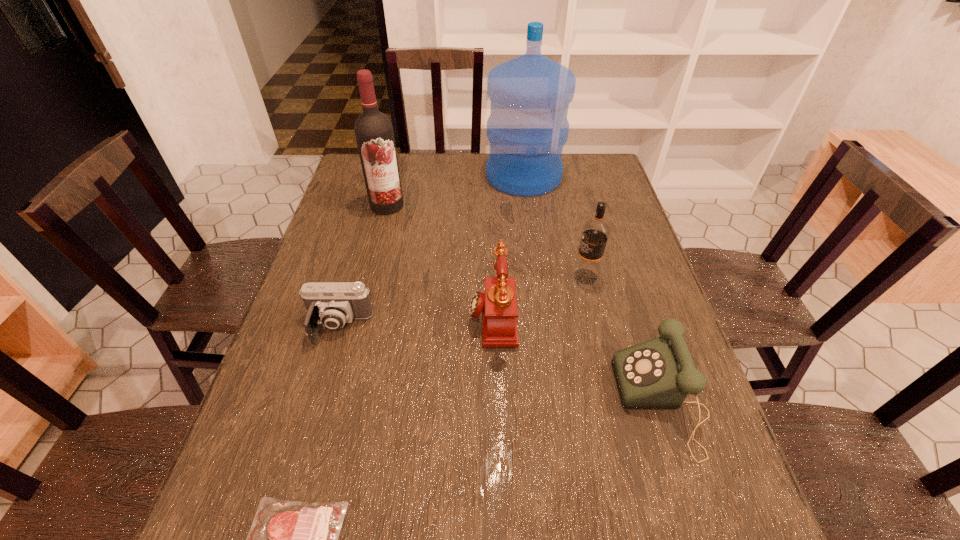
Locate an element on the screen. The height and width of the screenshot is (540, 960). free space between the second tallest object and the water jug is located at coordinates [455, 191].

Where is `vacant point located between the water jug and the shorter telephone`? Image resolution: width=960 pixels, height=540 pixels. vacant point located between the water jug and the shorter telephone is located at coordinates (593, 289).

The image size is (960, 540). Identify the location of free space that is in between the third shortest object and the sixth tallest object. (500, 364).

Find the location of a particular element. The width and height of the screenshot is (960, 540). vacant space that's between the sixth shortest object and the vodka is located at coordinates (486, 241).

You are a GUI agent. You are given a task and a screenshot of the screen. Output one action in this format:
    pyautogui.click(x=<x>, y=<y>)
    Task: Click on the free space between the fourth tallest object and the right telephone
    
    Given the screenshot: What is the action you would take?
    pyautogui.click(x=578, y=359)

Image resolution: width=960 pixels, height=540 pixels. Find the location of `empty location between the water jug and the right telephone`. empty location between the water jug and the right telephone is located at coordinates (593, 289).

Find the location of a particular element. unoccupied area between the third tallest object and the water jug is located at coordinates (555, 226).

Locate an element on the screen. The image size is (960, 540). the closest object to the fifth tallest object is located at coordinates (498, 304).

Locate an element on the screen. This screenshot has width=960, height=540. object that is the closest one to the water jug is located at coordinates (374, 134).

Image resolution: width=960 pixels, height=540 pixels. Find the location of `free space that satisfies the following two spatial constraints: 1. on the front side of the water jug; 2. on the dial of the fourth tallest object`. free space that satisfies the following two spatial constraints: 1. on the front side of the water jug; 2. on the dial of the fourth tallest object is located at coordinates (541, 315).